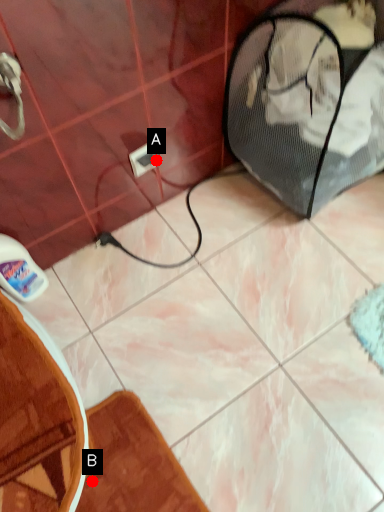
Question: Two points are circled on the image, labeled by A and B beside each circle. Which point is farther to the camera?

Choices:
 (A) A is further
 (B) B is further

Answer: (A)